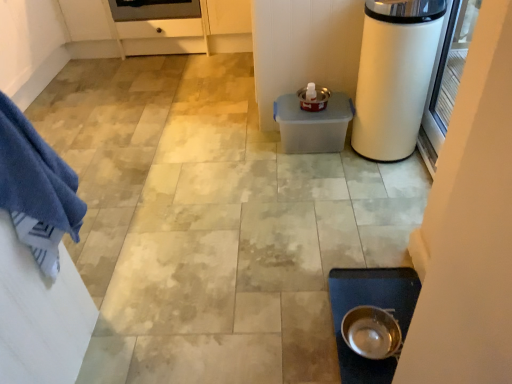
Question: Is transparent glass screen door at right not near blue cotton towel at left?

Choices:
 (A) yes
 (B) no

Answer: (A)

Question: Is transparent glass screen door at right at the right side of blue cotton towel at left?

Choices:
 (A) no
 (B) yes

Answer: (B)

Question: Can you confirm if transparent glass screen door at right is positioned to the left of blue cotton towel at left?

Choices:
 (A) no
 (B) yes

Answer: (A)

Question: From a real-world perspective, is transparent glass screen door at right physically above blue cotton towel at left?

Choices:
 (A) no
 (B) yes

Answer: (A)

Question: From the image's perspective, does transparent glass screen door at right appear lower than blue cotton towel at left?

Choices:
 (A) no
 (B) yes

Answer: (A)

Question: From a real-world perspective, is transparent glass screen door at right positioned under blue cotton towel at left based on gravity?

Choices:
 (A) yes
 (B) no

Answer: (A)

Question: Is blue cotton towel at left wider than metallic silver bowl at lower center?

Choices:
 (A) no
 (B) yes

Answer: (B)

Question: From a real-world perspective, is blue cotton towel at left positioned over metallic silver bowl at lower center based on gravity?

Choices:
 (A) yes
 (B) no

Answer: (A)

Question: Can you confirm if blue cotton towel at left is thinner than metallic silver bowl at lower center?

Choices:
 (A) yes
 (B) no

Answer: (B)

Question: Can you confirm if blue cotton towel at left is shorter than metallic silver bowl at lower center?

Choices:
 (A) no
 (B) yes

Answer: (A)

Question: Does blue cotton towel at left appear on the right side of metallic silver bowl at lower center?

Choices:
 (A) yes
 (B) no

Answer: (B)

Question: Considering the relative sizes of blue cotton towel at left and metallic silver bowl at lower center in the image provided, is blue cotton towel at left bigger than metallic silver bowl at lower center?

Choices:
 (A) no
 (B) yes

Answer: (B)

Question: From a real-world perspective, is white glossy trash can at right physically below blue cotton towel at left?

Choices:
 (A) yes
 (B) no

Answer: (A)